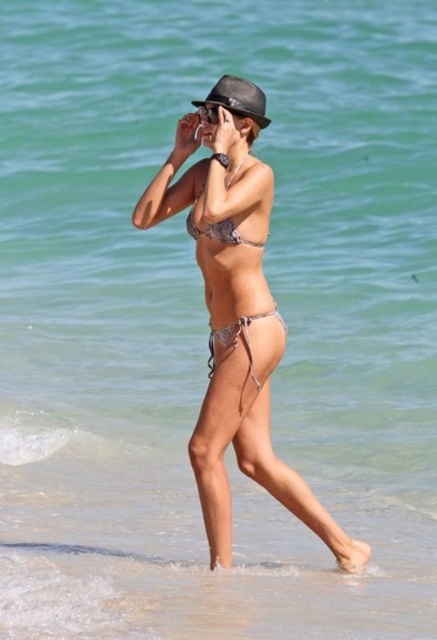
You are a photographer trying to capture the metallic bikini at center and the matte black fedora at upper center in focus. Which object should you focus on first to ensure both are sharp in the photo?

You should focus on the metallic bikini at center first because it is closer to the viewer than the matte black fedora at upper center, allowing for better depth of field coverage.

You are a photographer trying to capture the shiny metallic bikini at center and the matte black fedora at upper center in a single frame. Since you want both objects to be clearly visible, which object should you focus on first to ensure it appears sharp in the photo?

The shiny metallic bikini at center is larger in size than the matte black fedora at upper center, so you should focus on the shiny metallic bikini at center first to ensure it appears sharp. Larger objects require more precise focus to capture all details clearly.

You are a fashion designer analyzing the beach scene. You need to determine if the matte black fedora at upper center can be placed on a display stand designed for items narrower than the shiny silver bikini top at center. Can it fit?

The matte black fedora at upper center has a width less than the shiny silver bikini top at center, so it can fit on the display stand designed for items narrower than the shiny silver bikini top at center.